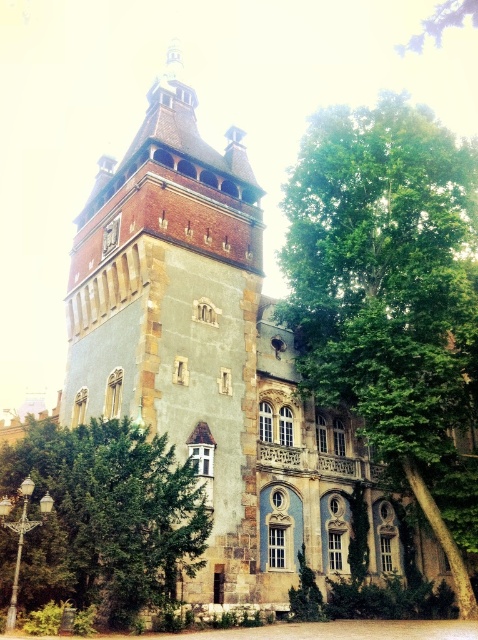
You are standing in front of the grand historic building and want to take a photo that includes both the building and the green leafy tree at right. If your camera has a maximum zoom range of 50 meters, will you be able to capture both in the same frame without moving closer?

The green leafy tree at right is 48.64 meters away from the viewer. Since the camera can zoom up to 50 meters, it is possible to capture both the building and the tree in the same frame without moving closer.

You are standing in front of the historic building and want to take a photo that includes both the green leafy tree at right and the green leafy tree at lower left. Which tree should you position closer to the center of the frame to ensure both are visible without cropping?

You should position the green leafy tree at lower left closer to the center of the frame because it is smaller in size than the green leafy tree at right, allowing both to fit within the frame without cropping.

You are standing in front of the grand historic building. There is a point marked at coordinates (391, 296) on the image. Which object from the scene does this point correspond to?

The point at coordinates (391, 296) corresponds to the green leafy tree at right.